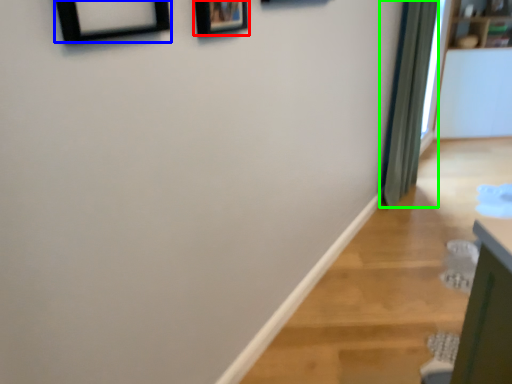
Question: Which object is positioned closest to picture frame (highlighted by a red box)? Select from picture frame (highlighted by a blue box) and curtain (highlighted by a green box).

Choices:
 (A) picture frame
 (B) curtain

Answer: (A)